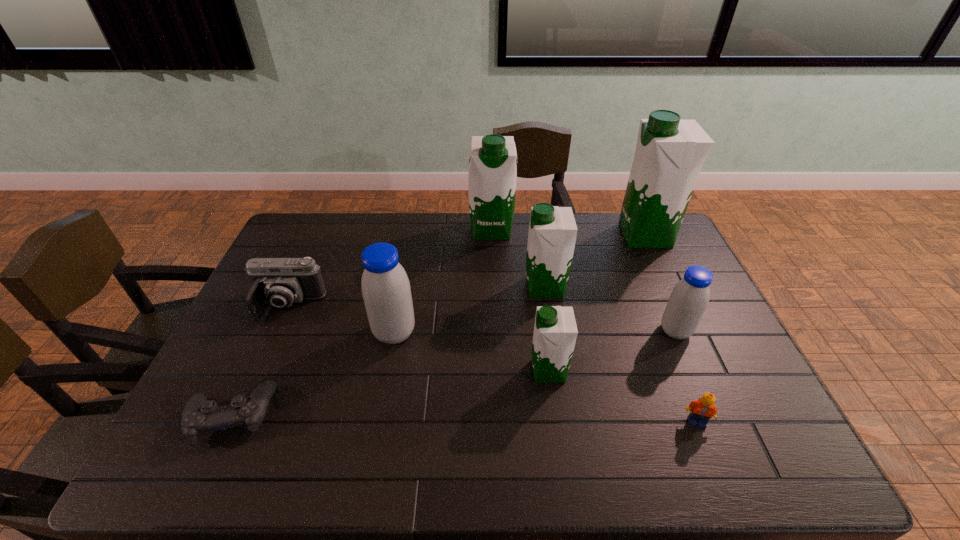
Find the location of a particular element. The height and width of the screenshot is (540, 960). the tallest soya milk is located at coordinates (670, 152).

At what (x,y) coordinates should I click in order to perform the action: click on the tallest object. Please return your answer as a coordinate pair (x, y). The height and width of the screenshot is (540, 960). Looking at the image, I should click on (670, 152).

You are a GUI agent. You are given a task and a screenshot of the screen. Output one action in this format:
    pyautogui.click(x=<x>, y=<y>)
    Task: Click on the fifth soya milk from right to left
    This screenshot has width=960, height=540.
    Given the screenshot: What is the action you would take?
    pyautogui.click(x=492, y=172)

Image resolution: width=960 pixels, height=540 pixels. In order to click on the leftmost green soya milk in this screenshot , I will do `click(492, 172)`.

The image size is (960, 540). Find the location of `the third farthest soya milk`. the third farthest soya milk is located at coordinates (552, 233).

Find the location of a particular element. This screenshot has height=540, width=960. the third biggest green soya milk is located at coordinates (552, 233).

The height and width of the screenshot is (540, 960). I want to click on the third object from left to right, so click(386, 291).

Locate an element on the screen. The width and height of the screenshot is (960, 540). the leftmost soya milk is located at coordinates (386, 291).

I want to click on the smallest green soya milk, so click(555, 331).

Locate an element on the screen. The height and width of the screenshot is (540, 960). the nearest green soya milk is located at coordinates (555, 331).